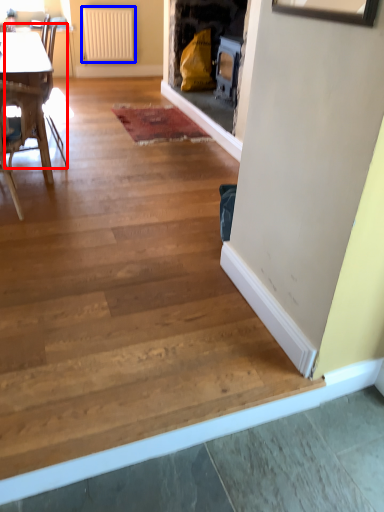
Question: Which of the following is the farthest to the observer, armchair (highlighted by a red box) or radiator (highlighted by a blue box)?

Choices:
 (A) armchair
 (B) radiator

Answer: (B)